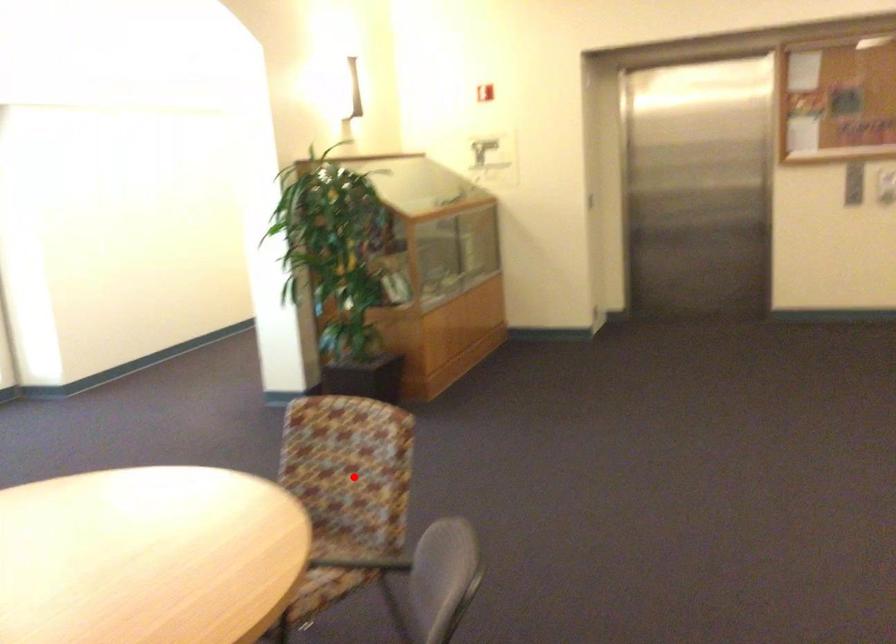
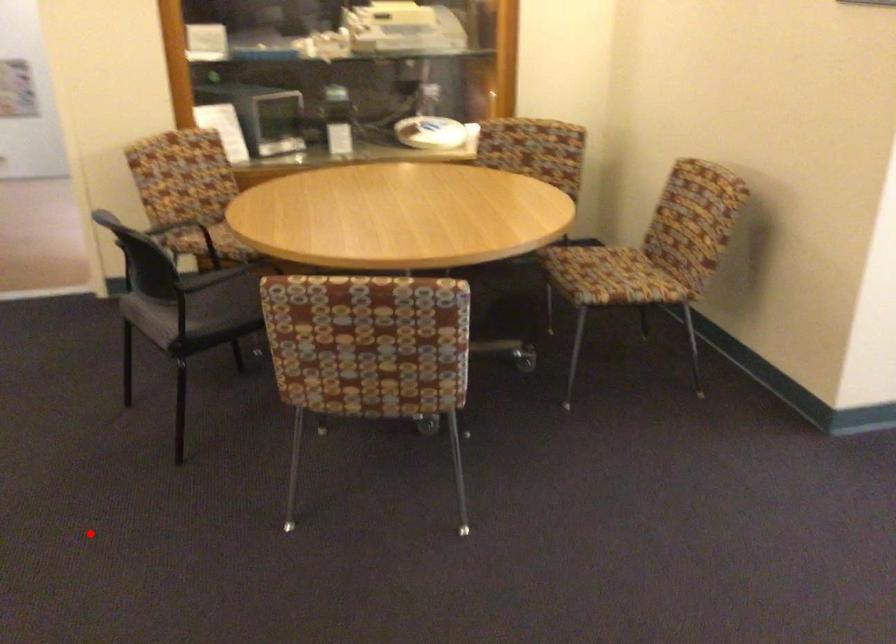
I am providing you with two images of the same scene from different viewpoints. A red point is marked on the first image and another point is marked on the second image. Do the highlighted points in image1 and image2 indicate the same real-world spot?

No